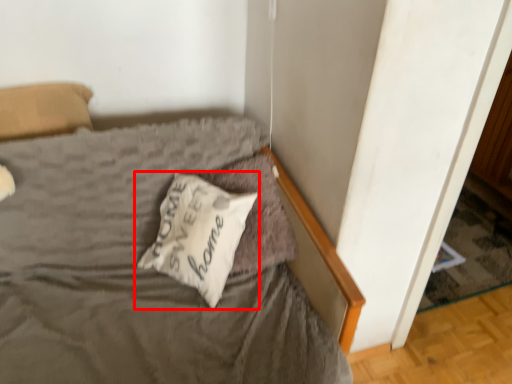
Question: From the image's perspective, considering the relative positions of pillow (annotated by the red box) and pillow in the image provided, where is pillow (annotated by the red box) located with respect to the staircase?

Choices:
 (A) below
 (B) above

Answer: (A)